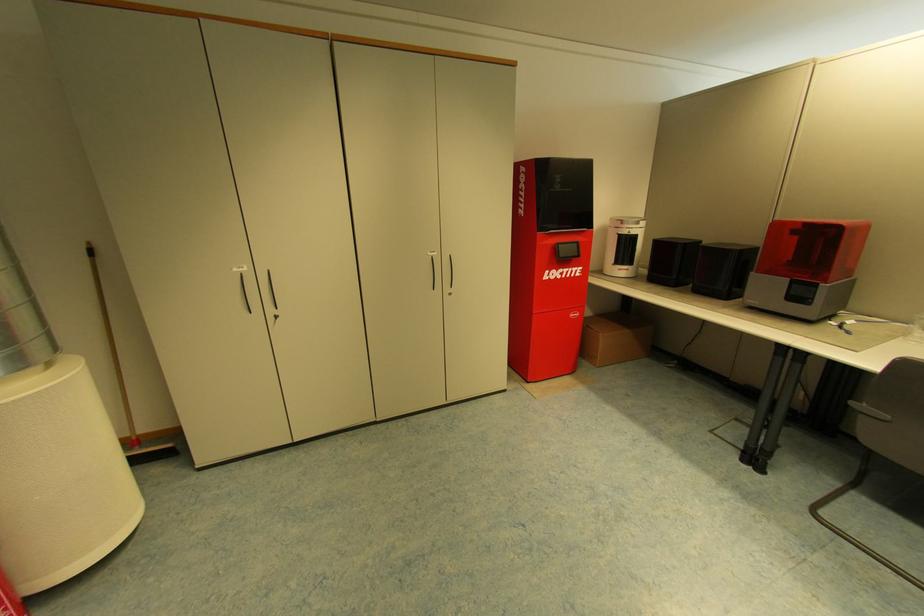
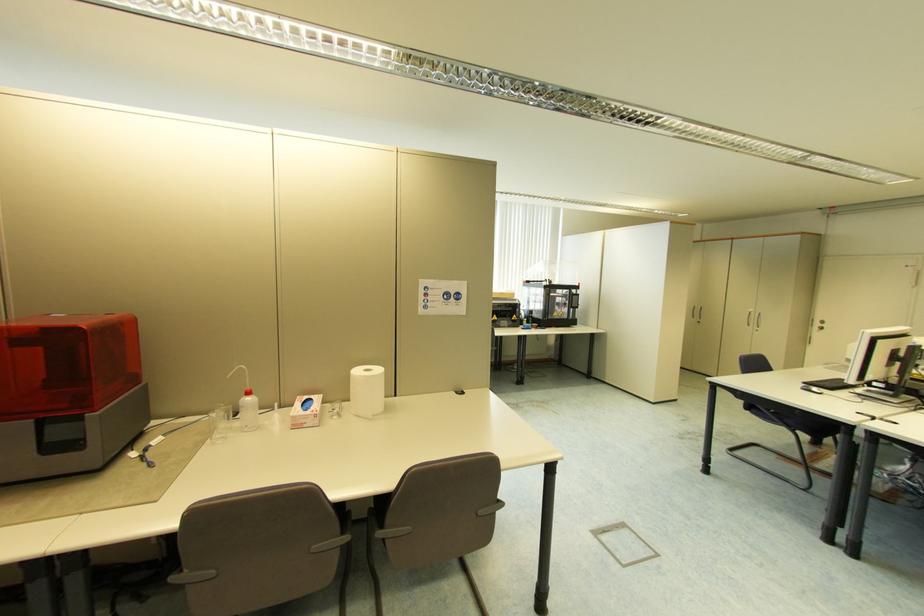
In the second image, find the point that corresponds to (865,403) in the first image.

(185, 572)